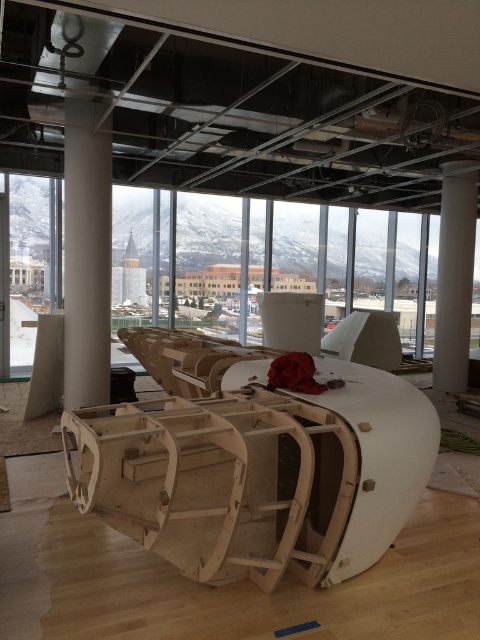
Question: Which point is closer to the camera?

Choices:
 (A) (84, 202)
 (B) (233, 461)

Answer: (B)

Question: Can you confirm if natural wood boat at center is bigger than white smooth column at center?

Choices:
 (A) no
 (B) yes

Answer: (B)

Question: Does natural wood boat at center lie in front of white smooth column at center?

Choices:
 (A) no
 (B) yes

Answer: (B)

Question: Which of the following is the closest to the observer?

Choices:
 (A) pyautogui.click(x=244, y=488)
 (B) pyautogui.click(x=68, y=264)

Answer: (A)

Question: Does white smooth column at left come in front of white smooth column at center?

Choices:
 (A) yes
 (B) no

Answer: (A)

Question: Estimate the real-world distances between objects in this image. Which object is closer to the white smooth column at center?

Choices:
 (A) natural wood boat at center
 (B) white smooth column at left

Answer: (B)